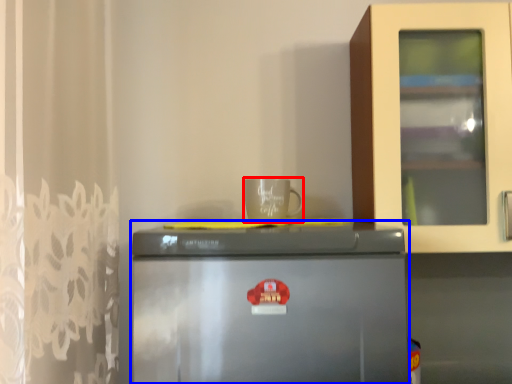
Question: Which point is closer to the camera, coffee cup (highlighted by a red box) or refrigerator (highlighted by a blue box)?

Choices:
 (A) coffee cup
 (B) refrigerator

Answer: (B)